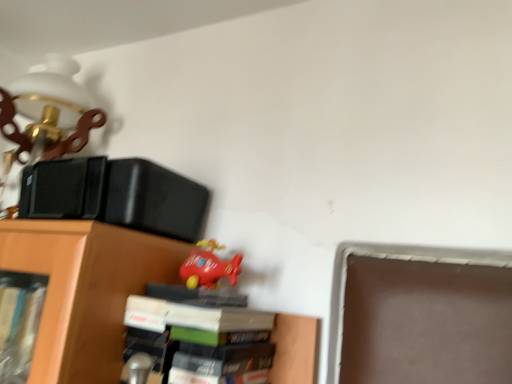
Question: Can you confirm if rubberized red airplane at upper center is positioned to the left of hardcover book at center?

Choices:
 (A) no
 (B) yes

Answer: (B)

Question: From the image's perspective, is rubberized red airplane at upper center beneath hardcover book at center?

Choices:
 (A) yes
 (B) no

Answer: (B)

Question: From a real-world perspective, does rubberized red airplane at upper center sit lower than hardcover book at center?

Choices:
 (A) yes
 (B) no

Answer: (B)

Question: Is rubberized red airplane at upper center looking in the opposite direction of hardcover book at center?

Choices:
 (A) no
 (B) yes

Answer: (A)

Question: Is rubberized red airplane at upper center wider than hardcover book at center?

Choices:
 (A) yes
 (B) no

Answer: (B)

Question: Is rubberized red airplane at upper center positioned beyond the bounds of hardcover book at center?

Choices:
 (A) no
 (B) yes

Answer: (B)

Question: Is hardcover book at center not within rubberized red airplane at upper center?

Choices:
 (A) no
 (B) yes

Answer: (B)

Question: Is hardcover book at center to the right of rubberized red airplane at upper center from the viewer's perspective?

Choices:
 (A) no
 (B) yes

Answer: (B)

Question: Are hardcover book at center and rubberized red airplane at upper center located far from each other?

Choices:
 (A) no
 (B) yes

Answer: (A)

Question: Is hardcover book at center smaller than rubberized red airplane at upper center?

Choices:
 (A) yes
 (B) no

Answer: (B)

Question: Considering the relative sizes of hardcover book at center and rubberized red airplane at upper center in the image provided, is hardcover book at center thinner than rubberized red airplane at upper center?

Choices:
 (A) yes
 (B) no

Answer: (B)

Question: From a real-world perspective, is hardcover book at center positioned under rubberized red airplane at upper center based on gravity?

Choices:
 (A) no
 (B) yes

Answer: (B)

Question: Looking at their shapes, would you say rubberized red airplane at upper center is wider or thinner than hardcover book at center?

Choices:
 (A) wide
 (B) thin

Answer: (B)